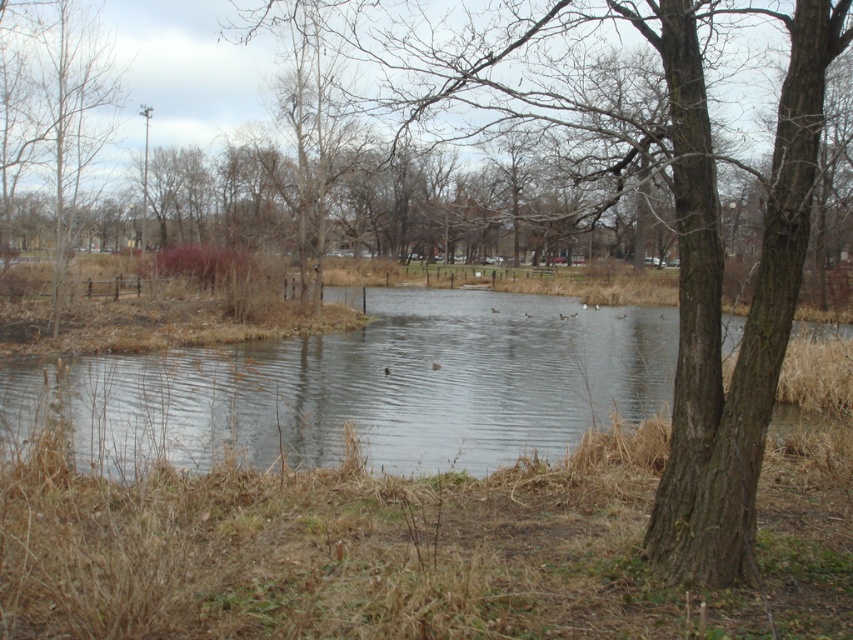
You are standing in the park and want to take a photo of both the brown rough tree at center and the brown bark tree at upper left. Which tree should you focus on first to ensure both are in clear view?

You should focus on the brown rough tree at center first because it is closer to you than the brown bark tree at upper left, so adjusting focus from near to far will help capture both clearly.

You are a park visitor wanting to take a photo of the brown rough tree at center and the brown bark tree at upper left. Which tree should you stand closer to in order to capture both in a single frame?

Since the brown rough tree at center is smaller than the brown bark tree at upper left, you should stand closer to the brown rough tree at center to include both in the frame.

Based on the photo, you are a bird looking for a place to perch. You see the brown rough tree at center and the brown bark tree at upper left. Which tree is closer to the ground where you can land?

The brown rough tree at center is positioned under brown bark tree at upper left, so it is closer to the ground and a better option for landing.